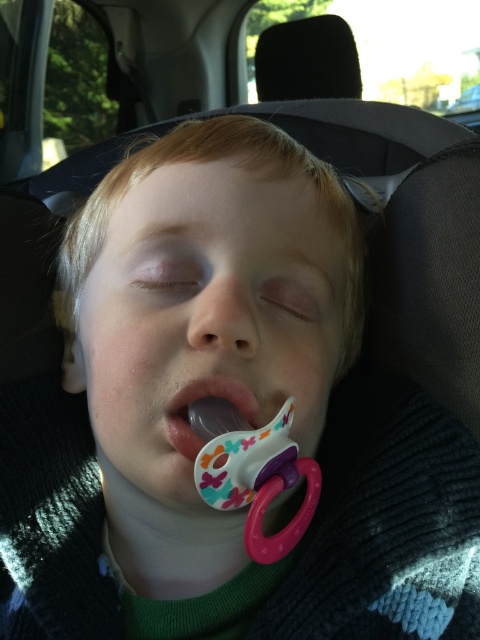
What do you see at coordinates (252, 472) in the screenshot? I see `matte plastic pacifier at center` at bounding box center [252, 472].

Can you confirm if matte plastic pacifier at center is thinner than white plastic pacifier at center?

Incorrect, matte plastic pacifier at center's width is not less than white plastic pacifier at center's.

Who is more forward, (275,465) or (176,420)?

Point (275,465)

This screenshot has height=640, width=480. I want to click on matte plastic pacifier at center, so click(x=252, y=472).

Does point (203, 394) lie behind point (471, 122)?

That is False.

The image size is (480, 640). Identify the location of white plastic pacifier at center. (200, 397).

Is point (312, 496) farther from viewer compared to point (468, 102)?

No, (312, 496) is in front of (468, 102).

Does matte plastic pacifier at center appear under black plastic car seat at upper center?

Yes, matte plastic pacifier at center is below black plastic car seat at upper center.

Describe the element at coordinates (252, 472) in the screenshot. I see `matte plastic pacifier at center` at that location.

You are a GUI agent. You are given a task and a screenshot of the screen. Output one action in this format:
    pyautogui.click(x=<x>, y=<y>)
    Task: Click on the matte plastic pacifier at center
    This screenshot has height=640, width=480.
    Given the screenshot: What is the action you would take?
    pyautogui.click(x=252, y=472)